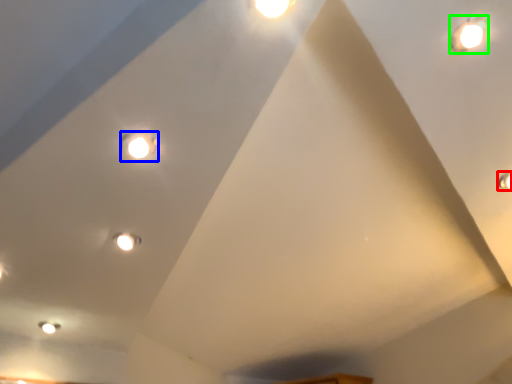
Question: Estimate the real-world distances between objects in this image. Which object is closer to light (highlighted by a red box), light (highlighted by a blue box) or droplight (highlighted by a green box)?

Choices:
 (A) light
 (B) droplight

Answer: (B)